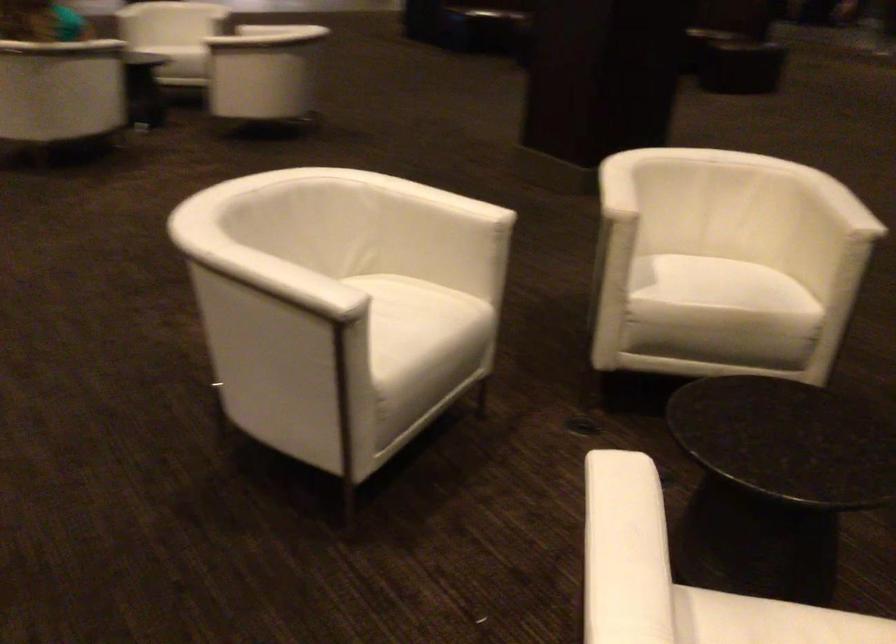
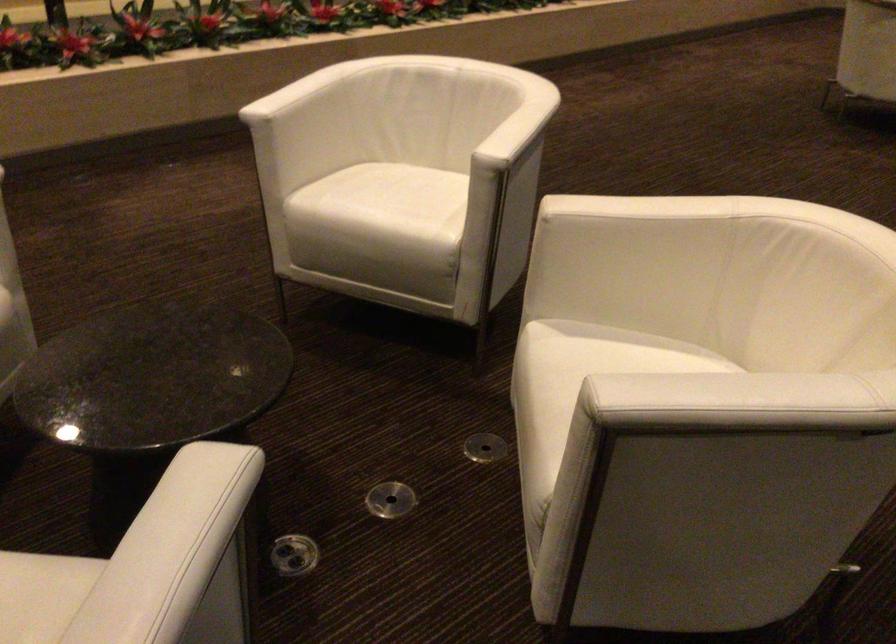
The point at (417,324) is marked in the first image. Where is the corresponding point in the second image?

(383, 205)